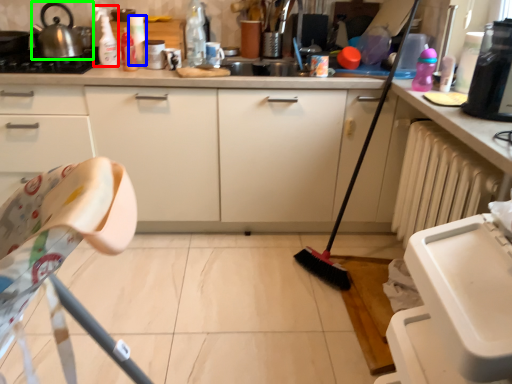
Question: Which object is the farthest from cleaning product (highlighted by a red box)? Choose among these: bottle (highlighted by a blue box) or tea pot (highlighted by a green box).

Choices:
 (A) bottle
 (B) tea pot

Answer: (A)